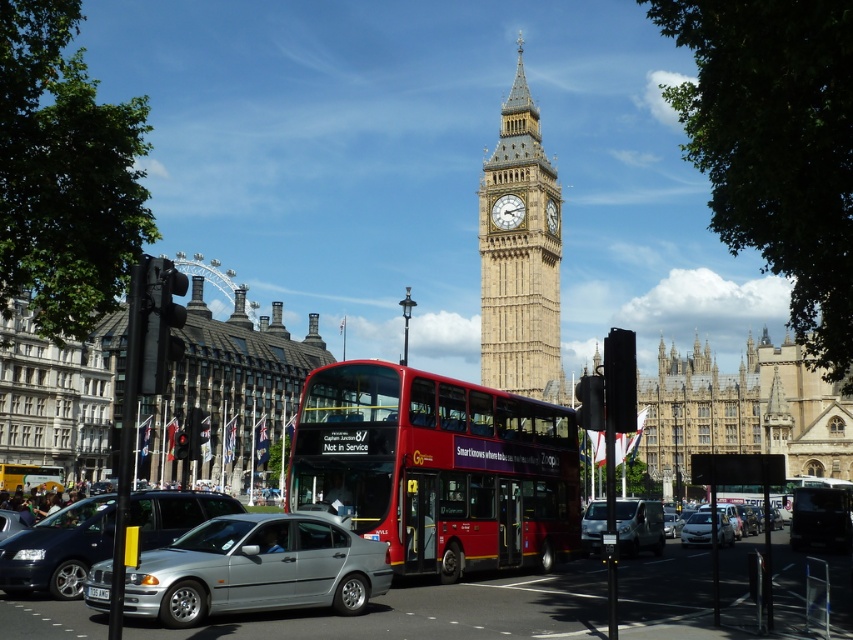
Question: Can you confirm if red metallic bus at center is positioned to the left of silver metallic sedan at lower left?

Choices:
 (A) no
 (B) yes

Answer: (A)

Question: Can you confirm if silver metallic sedan at lower left is thinner than white plastic license plate at center?

Choices:
 (A) yes
 (B) no

Answer: (B)

Question: Which point is closer to the camera taking this photo?

Choices:
 (A) (482, 280)
 (B) (299, 600)
 (C) (412, 547)
 (D) (164, 531)

Answer: (B)

Question: Which of the following is the farthest from the observer?

Choices:
 (A) stone clock tower at center
 (B) red metallic bus at center
 (C) silver metallic van at center

Answer: (A)

Question: Which point is closer to the camera?

Choices:
 (A) (302, 564)
 (B) (236, 502)

Answer: (A)

Question: From the image, what is the correct spatial relationship of red metallic bus at center in relation to white plastic license plate at center?

Choices:
 (A) below
 (B) above

Answer: (B)